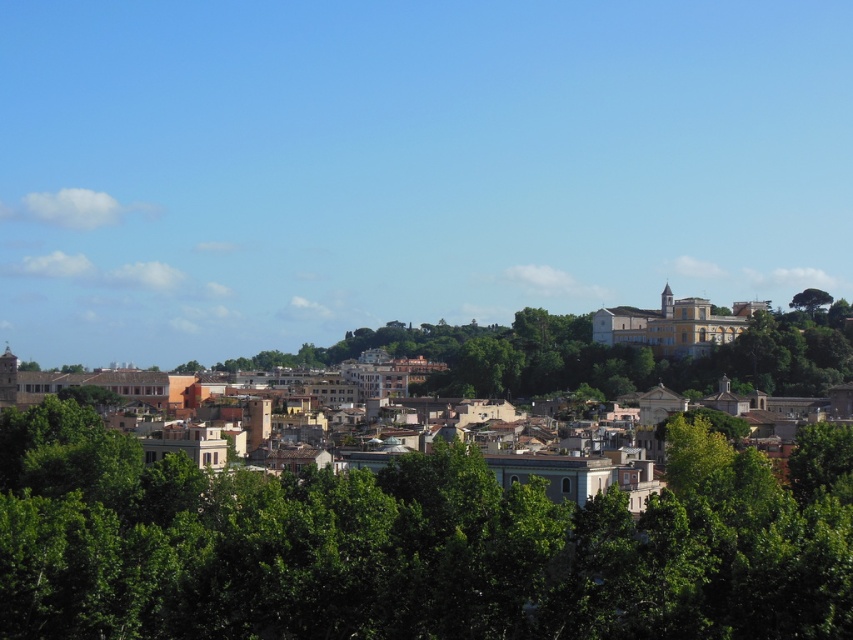
Question: Does yellowish stone buildings at center have a smaller size compared to green leafy tree at upper right?

Choices:
 (A) no
 (B) yes

Answer: (A)

Question: Which object is the farthest from the green leafy tree at center?

Choices:
 (A) green leafy tree at upper right
 (B) yellowish stone buildings at center

Answer: (A)

Question: Does yellowish stone buildings at center have a larger size compared to green leafy tree at upper right?

Choices:
 (A) yes
 (B) no

Answer: (A)

Question: Which point appears farthest from the camera in this image?

Choices:
 (A) (811, 312)
 (B) (756, 387)

Answer: (A)

Question: Does green leafy tree at center have a larger size compared to yellowish stone buildings at center?

Choices:
 (A) no
 (B) yes

Answer: (A)

Question: Which object appears closest to the camera in this image?

Choices:
 (A) yellowish stone buildings at center
 (B) green leafy tree at center

Answer: (B)